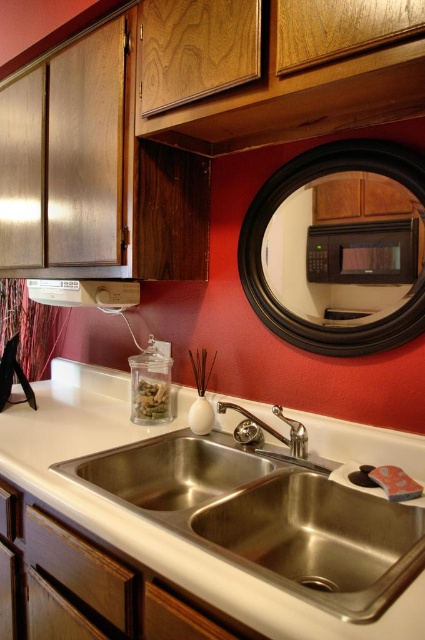
Question: Is white glossy countertop at center bigger than black framed mirror at upper center?

Choices:
 (A) no
 (B) yes

Answer: (B)

Question: Which of the following is the farthest from the observer?

Choices:
 (A) polished chrome faucet at center
 (B) black matte microwave at upper center
 (C) white glossy countertop at center

Answer: (A)

Question: Which point appears closest to the camera in this image?

Choices:
 (A) (336, 262)
 (B) (226, 404)
 (C) (316, 346)

Answer: (A)

Question: Is black framed mirror at upper center closer to camera compared to polished chrome faucet at center?

Choices:
 (A) no
 (B) yes

Answer: (B)

Question: Can you confirm if white glossy countertop at center is positioned to the right of polished chrome faucet at center?

Choices:
 (A) no
 (B) yes

Answer: (A)

Question: Which is farther from the black matte microwave at upper center?

Choices:
 (A) polished chrome faucet at center
 (B) white glossy countertop at center
 (C) black framed mirror at upper center

Answer: (B)